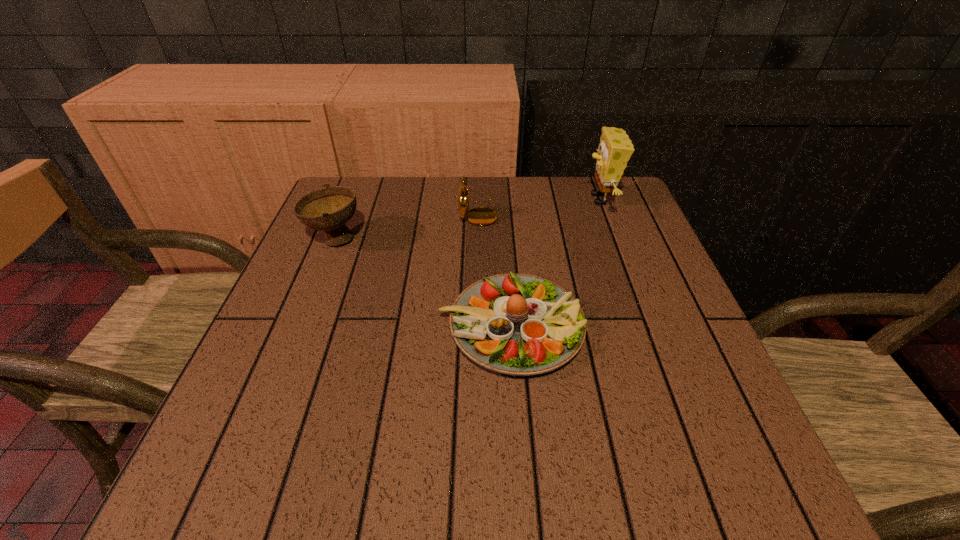
Image resolution: width=960 pixels, height=540 pixels. Find the location of `vacant space in between the leftmost object and the pocket watch`. vacant space in between the leftmost object and the pocket watch is located at coordinates pyautogui.click(x=406, y=226).

The height and width of the screenshot is (540, 960). In order to click on vacant area that lies between the leftmost object and the pocket watch in this screenshot , I will do `click(406, 226)`.

The image size is (960, 540). Identify the location of empty space that is in between the sponge and the pocket watch. (539, 206).

Locate an element on the screen. The width and height of the screenshot is (960, 540). vacant space that's between the tallest object and the salad plate is located at coordinates (556, 263).

This screenshot has height=540, width=960. I want to click on empty space that is in between the sponge and the nearest object, so pos(556,263).

Identify the location of free spot between the leftmost object and the salad plate. The width and height of the screenshot is (960, 540). (423, 283).

Identify which object is the second closest to the leftmost object. Please provide its 2D coordinates. Your answer should be formatted as a tuple, i.e. [(x, y)], where the tuple contains the x and y coordinates of a point satisfying the conditions above.

[(481, 216)]

Identify which object is located as the nearest to the nearest object. Please provide its 2D coordinates. Your answer should be formatted as a tuple, i.e. [(x, y)], where the tuple contains the x and y coordinates of a point satisfying the conditions above.

[(481, 216)]

At what (x,y) coordinates should I click in order to perform the action: click on blank space that satisfies the following two spatial constraints: 1. on the face of the pocket watch; 2. on the right side of the nearest object. Please return your answer as a coordinate pair (x, y). The width and height of the screenshot is (960, 540). Looking at the image, I should click on (476, 326).

The image size is (960, 540). Identify the location of vacant region that satisfies the following two spatial constraints: 1. on the back side of the shortest object; 2. on the face of the pocket watch. (503, 212).